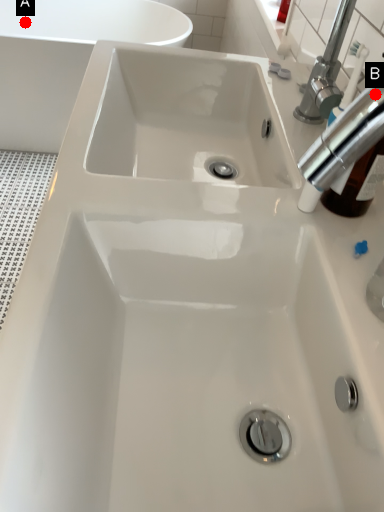
Question: Two points are circled on the image, labeled by A and B beside each circle. Which point appears closest to the camera in this image?

Choices:
 (A) A is closer
 (B) B is closer

Answer: (B)